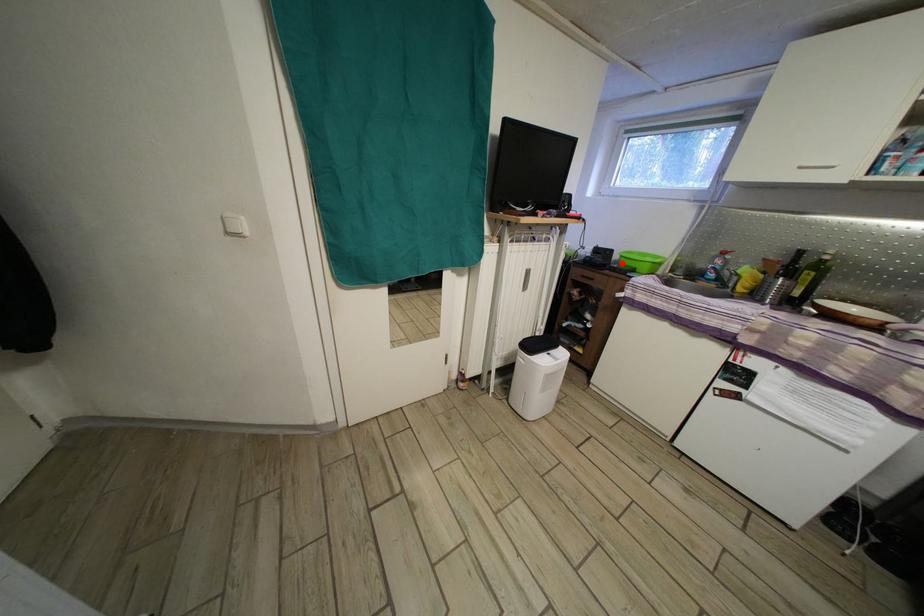
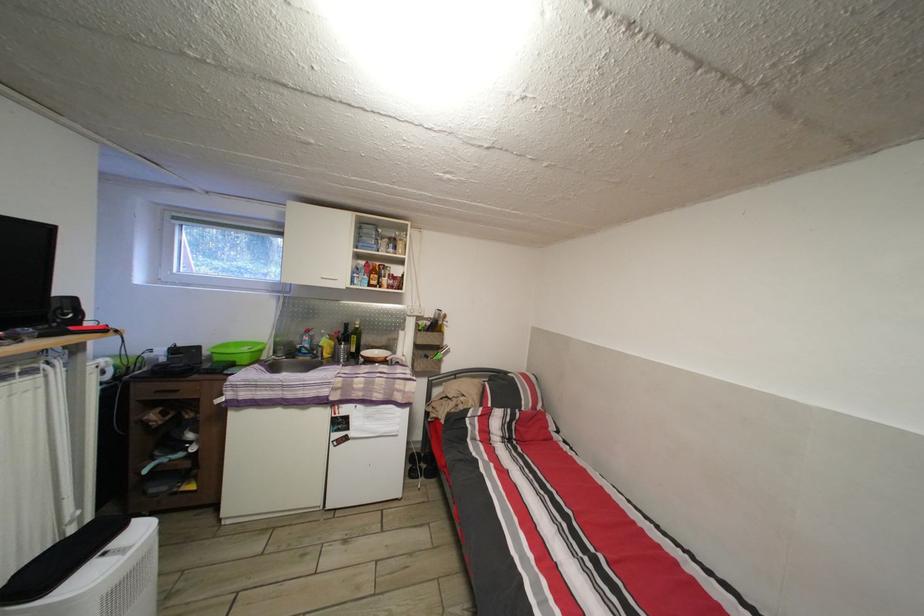
Question: I am providing you with two images of the same scene from different viewpoints. A red point is shown in image1. For the corresponding object point in image2, is it positioned nearer or farther from the camera?

Choices:
 (A) Nearer
 (B) Farther

Answer: (B)